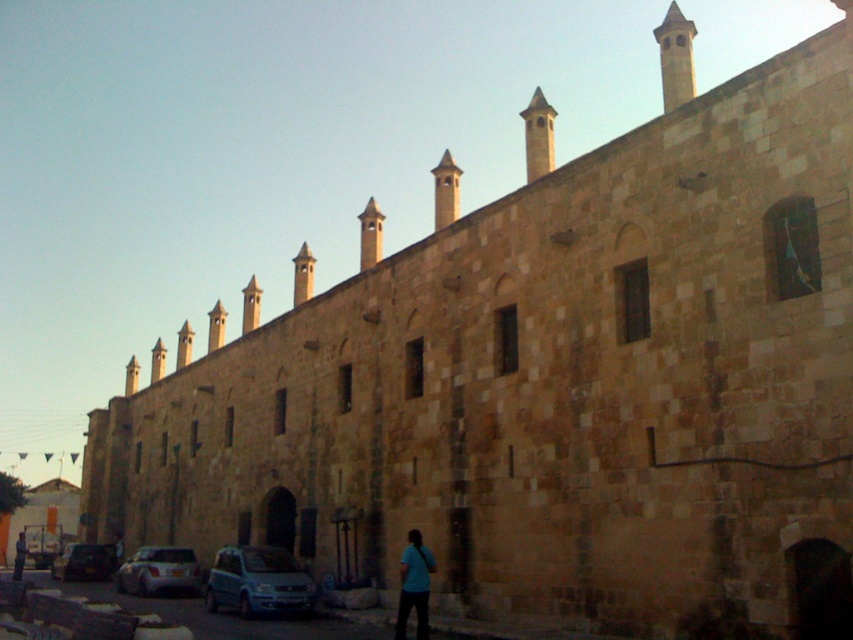
Can you confirm if blue metallic van at lower center is smaller than blue fabric bag at lower center?

No.

Between blue metallic van at lower center and blue fabric bag at lower center, which one is positioned lower?

blue metallic van at lower center is below.

Who is more forward, [281,605] or [416,596]?

Positioned in front is point [416,596].

This screenshot has height=640, width=853. Identify the location of blue metallic van at lower center. (258, 580).

Which is more to the right, blue fabric bag at lower center or metallic silver car at lower left?

blue fabric bag at lower center is more to the right.

Can you confirm if blue fabric bag at lower center is bigger than metallic silver car at lower left?

No, blue fabric bag at lower center is not bigger than metallic silver car at lower left.

Who is more distant from viewer, (418, 544) or (105, 548)?

Point (105, 548)

The width and height of the screenshot is (853, 640). I want to click on blue fabric bag at lower center, so click(x=415, y=586).

Which of these two, blue fabric bag at lower center or light blue shirt at lower center, stands taller?

light blue shirt at lower center

Is point (397, 612) behind point (21, 532)?

That is False.

You are a GUI agent. You are given a task and a screenshot of the screen. Output one action in this format:
    pyautogui.click(x=<x>, y=<y>)
    Task: Click on the blue fabric bag at lower center
    
    Given the screenshot: What is the action you would take?
    pyautogui.click(x=415, y=586)